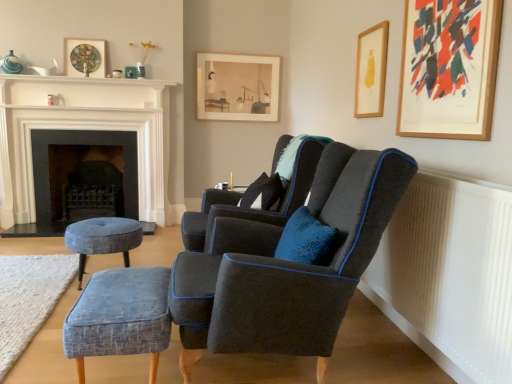
Question: Is white ribbed radiator at lower right far from wooden picture frame at upper right, the third picture frame in the left-to-right sequence?

Choices:
 (A) yes
 (B) no

Answer: (A)

Question: From a real-world perspective, is white ribbed radiator at lower right on wooden picture frame at upper right, the 2th picture frame from the right?

Choices:
 (A) no
 (B) yes

Answer: (A)

Question: Can you confirm if white ribbed radiator at lower right is smaller than wooden picture frame at upper right, placed as the 3th picture frame when sorted from back to front?

Choices:
 (A) no
 (B) yes

Answer: (A)

Question: Does white ribbed radiator at lower right have a greater width compared to wooden picture frame at upper right, which ranks as the second picture frame in front-to-back order?

Choices:
 (A) no
 (B) yes

Answer: (B)

Question: Does white ribbed radiator at lower right appear on the right side of wooden picture frame at upper right, which ranks as the second picture frame in front-to-back order?

Choices:
 (A) yes
 (B) no

Answer: (A)

Question: From a real-world perspective, is white glossy fireplace at upper left, the first fireplace positioned from the front, physically located above or below velvet blue stool at lower left, positioned as the 1th stool in left-to-right order?

Choices:
 (A) below
 (B) above

Answer: (B)

Question: Looking at their shapes, would you say white glossy fireplace at upper left, the first fireplace positioned from the front, is wider or thinner than velvet blue stool at lower left, positioned as the 1th stool in left-to-right order?

Choices:
 (A) thin
 (B) wide

Answer: (A)

Question: From the image's perspective, relative to velvet blue stool at lower left, arranged as the 2th stool when viewed from the right, is white glossy fireplace at upper left, acting as the second fireplace starting from the back, above or below?

Choices:
 (A) below
 (B) above

Answer: (B)

Question: From their relative heights in the image, would you say white glossy fireplace at upper left, acting as the second fireplace starting from the back, is taller or shorter than velvet blue stool at lower left, marked as the first stool in a back-to-front arrangement?

Choices:
 (A) tall
 (B) short

Answer: (A)

Question: In terms of height, does velvet blue stool at lower left, arranged as the 2th stool when viewed from the right, look taller or shorter compared to textured blue ottoman at lower left?

Choices:
 (A) tall
 (B) short

Answer: (A)

Question: In the image, is velvet blue stool at lower left, positioned as the 1th stool in left-to-right order, positioned in front of or behind textured blue ottoman at lower left?

Choices:
 (A) front
 (B) behind

Answer: (B)

Question: Looking at their shapes, would you say velvet blue stool at lower left, marked as the first stool in a back-to-front arrangement, is wider or thinner than textured blue ottoman at lower left?

Choices:
 (A) wide
 (B) thin

Answer: (B)

Question: From the image's perspective, is velvet blue stool at lower left, arranged as the 2th stool when viewed from the right, positioned above or below textured blue ottoman at lower left?

Choices:
 (A) above
 (B) below

Answer: (A)

Question: From the image's perspective, is matte glass picture frame at upper left, the third picture frame when ordered from front to back, above or below white glossy fireplace at upper left, the first fireplace positioned from the front?

Choices:
 (A) above
 (B) below

Answer: (A)

Question: Considering their positions, is matte glass picture frame at upper left, acting as the second picture frame starting from the back, located in front of or behind white glossy fireplace at upper left, the first fireplace positioned from the front?

Choices:
 (A) behind
 (B) front

Answer: (A)